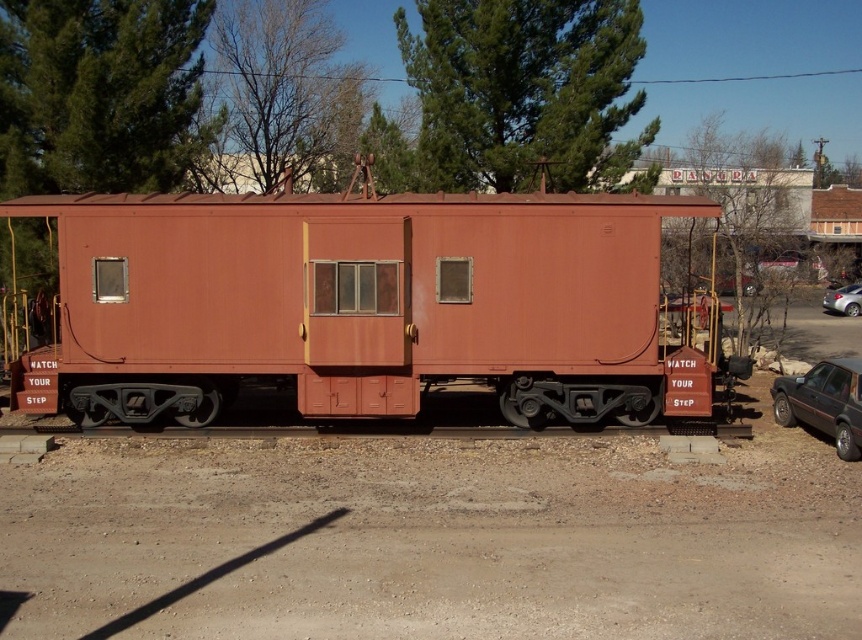
You are a railway inspector checking the distance between two cabooses for safety regulations. The minimum required distance between operational cabooses is 18 feet. Are the rusty metal caboose at center and the matte red caboose at center compliant with this regulation?

The rusty metal caboose at center is 17.91 feet from matte red caboose at center. Since the minimum required distance is 18 feet, the distance between them is insufficient, so they are not compliant with the regulation.